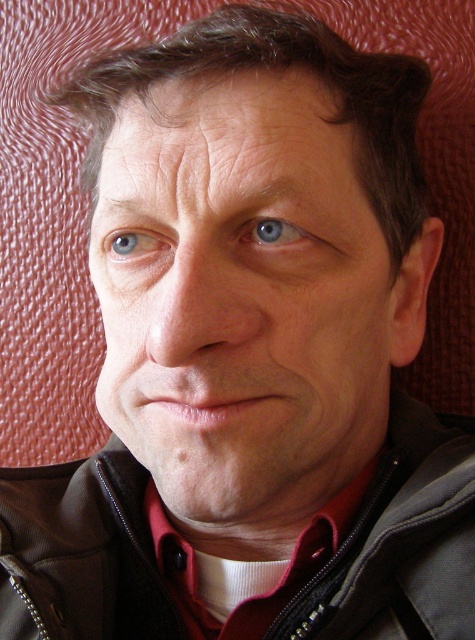
Question: Can you confirm if matte black face at center is bigger than dark brown leather jacket at center?

Choices:
 (A) yes
 (B) no

Answer: (B)

Question: Among these points, which one is nearest to the camera?

Choices:
 (A) (417, 420)
 (B) (163, 236)
 (C) (276, 224)
 (D) (171, 452)

Answer: (C)

Question: Is dark brown leather jacket at center behind blue glossy eye at center?

Choices:
 (A) no
 (B) yes

Answer: (B)

Question: Which object is closer to the camera taking this photo?

Choices:
 (A) blue glossy eye at center
 (B) matte black face at center
 (C) dark brown leather jacket at center
 (D) blue matte eye at upper left

Answer: (B)

Question: Does matte black face at center lie behind blue matte eye at upper left?

Choices:
 (A) yes
 (B) no

Answer: (B)

Question: Among these points, which one is farthest from the camera?

Choices:
 (A) (285, 244)
 (B) (309, 628)
 (C) (341, 371)

Answer: (B)